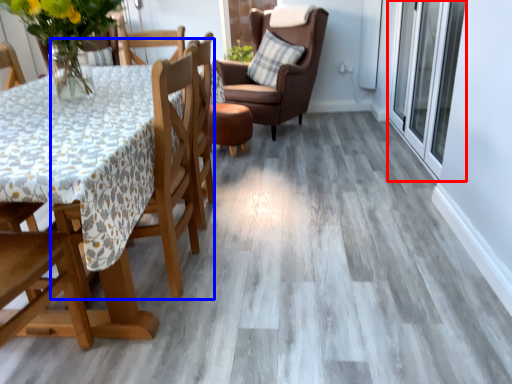
Question: Which object appears closest to the camera in this image, screen door (highlighted by a red box) or chair (highlighted by a blue box)?

Choices:
 (A) screen door
 (B) chair

Answer: (B)